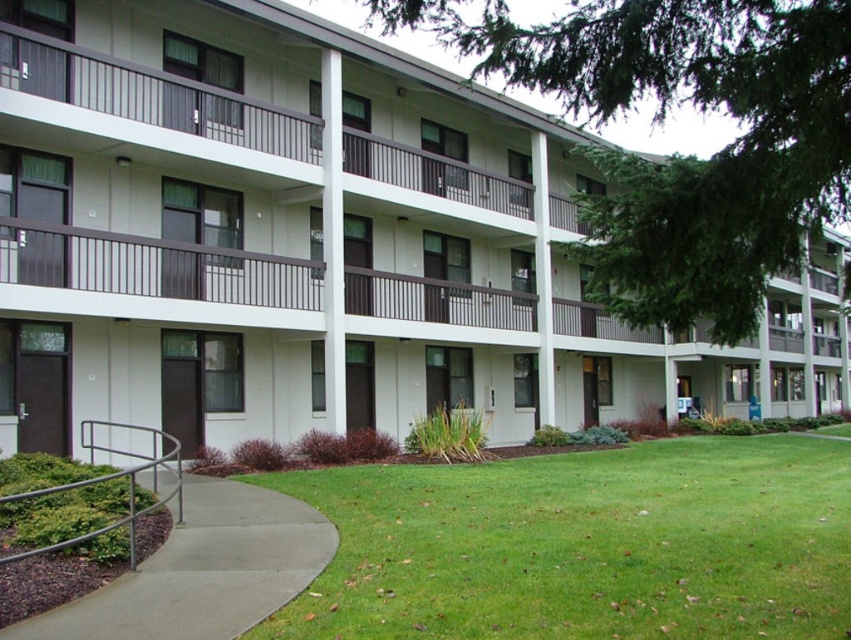
You are standing at the entrance of the residential building and want to walk to the green leafy tree at center. Which direction should you turn to reach it from the concrete at lower left?

The green leafy tree at center is to the right of the concrete at lower left, so you should turn right to reach it.

You are a delivery person standing at the entrance of the residential building. You need to deliver a package to the apartment located on the second floor. The apartment has a balcony with a door that is 4 meters away from the green leafy tree at center. Can you determine if the balcony door is closer to or farther from the tree compared to your current position?

The green leafy tree at center is 3.88 meters from the camera. The balcony door is 4 meters away from the tree, so the balcony door is farther from the tree than your current position.